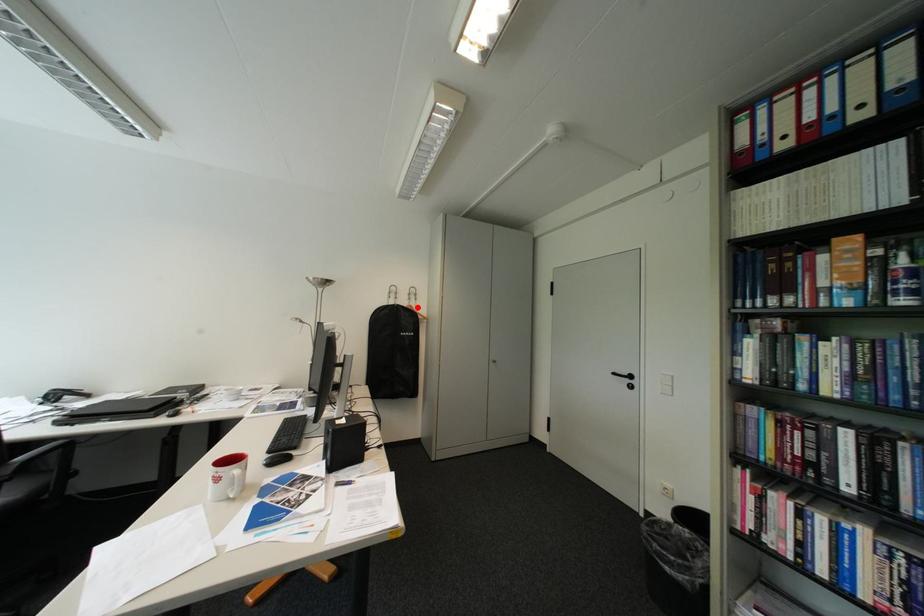
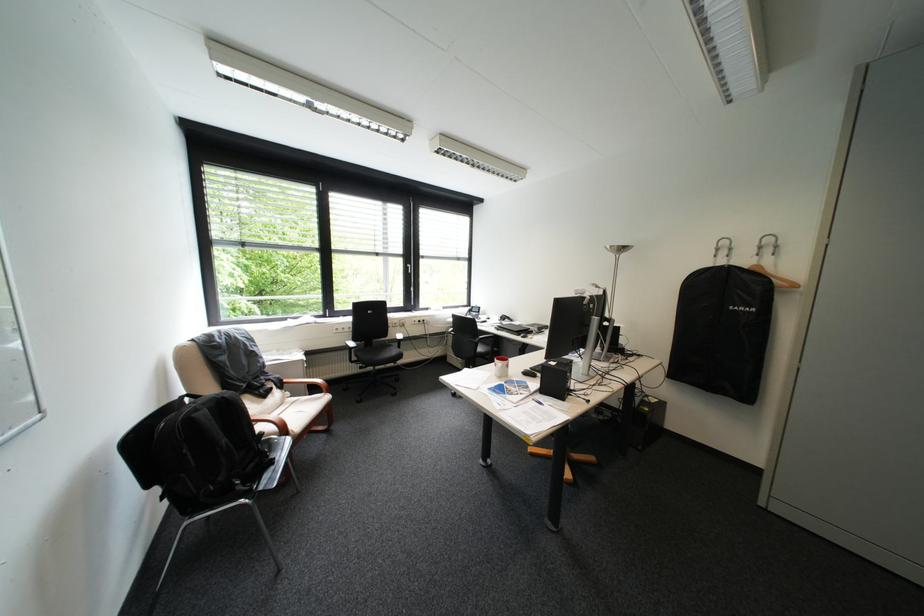
Where in the second image is the point corresponding to the highlighted location from the first image?

(759, 268)